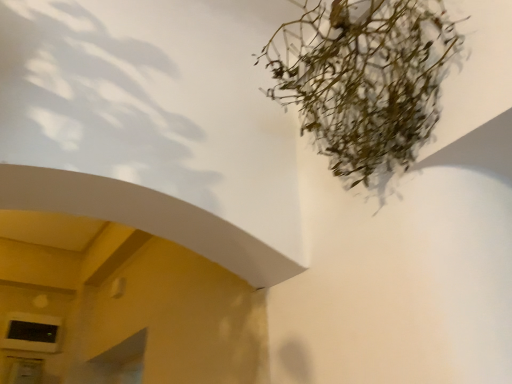
In order to click on matte black window at lower left in this screenshot , I will do click(x=32, y=332).

Measure the distance between matte black window at lower left and camera.

8.16 feet.

This screenshot has width=512, height=384. What do you see at coordinates (32, 332) in the screenshot?
I see `matte black window at lower left` at bounding box center [32, 332].

Locate an element on the screen. The width and height of the screenshot is (512, 384). green matte plant at upper right is located at coordinates (365, 80).

The width and height of the screenshot is (512, 384). What do you see at coordinates (365, 80) in the screenshot?
I see `green matte plant at upper right` at bounding box center [365, 80].

The height and width of the screenshot is (384, 512). Find the location of `matte black window at lower left`. matte black window at lower left is located at coordinates (32, 332).

Is matte black window at lower left to the right of green matte plant at upper right from the viewer's perspective?

No.

Who is more distant, matte black window at lower left or green matte plant at upper right?

matte black window at lower left is behind.

Considering the points (15, 339) and (340, 24), which point is behind, point (15, 339) or point (340, 24)?

The point (15, 339) is farther.

From the image's perspective, is matte black window at lower left located above or below green matte plant at upper right?

matte black window at lower left is situated lower than green matte plant at upper right in the image.

From a real-world perspective, is matte black window at lower left beneath green matte plant at upper right?

Yes, from a real-world perspective, matte black window at lower left is under green matte plant at upper right.

Considering the sizes of matte black window at lower left and green matte plant at upper right in the image, is matte black window at lower left wider or thinner than green matte plant at upper right?

In the image, matte black window at lower left appears to be more narrow than green matte plant at upper right.

Looking at this image, is matte black window at lower left shorter than green matte plant at upper right?

Indeed, matte black window at lower left has a lesser height compared to green matte plant at upper right.

Who is bigger, matte black window at lower left or green matte plant at upper right?

green matte plant at upper right is bigger.

Is matte black window at lower left inside or outside of green matte plant at upper right?

matte black window at lower left cannot be found inside green matte plant at upper right.

Is matte black window at lower left positioned far away from green matte plant at upper right?

Yes, matte black window at lower left and green matte plant at upper right are located far from each other.

Could you tell me if matte black window at lower left is facing green matte plant at upper right?

Yes, matte black window at lower left is turned towards green matte plant at upper right.

You are a GUI agent. You are given a task and a screenshot of the screen. Output one action in this format:
    pyautogui.click(x=<x>, y=<y>)
    Task: Click on the houseplant in front of the matte black window at lower left
    This screenshot has height=384, width=512.
    Given the screenshot: What is the action you would take?
    pyautogui.click(x=365, y=80)

Considering the positions of objects green matte plant at upper right and matte black window at lower left in the image provided, who is more to the left, green matte plant at upper right or matte black window at lower left?

From the viewer's perspective, matte black window at lower left appears more on the left side.

Is green matte plant at upper right positioned behind matte black window at lower left?

No, green matte plant at upper right is in front of matte black window at lower left.

Is point (352, 136) farther from camera compared to point (34, 320)?

No, it is in front of (34, 320).

From the image's perspective, is green matte plant at upper right above or below matte black window at lower left?

From the image's perspective, green matte plant at upper right appears above matte black window at lower left.

From a real-world perspective, which object rests below the other?

matte black window at lower left.

Is green matte plant at upper right wider or thinner than matte black window at lower left?

green matte plant at upper right is wider than matte black window at lower left.

From the picture: Which of these two, green matte plant at upper right or matte black window at lower left, stands taller?

green matte plant at upper right is taller.

Considering the sizes of objects green matte plant at upper right and matte black window at lower left in the image provided, who is bigger, green matte plant at upper right or matte black window at lower left?

green matte plant at upper right is bigger.

Is green matte plant at upper right inside the boundaries of matte black window at lower left, or outside?

green matte plant at upper right is not inside matte black window at lower left, it's outside.

Is green matte plant at upper right positioned far away from matte black window at lower left?

Yes.

Is green matte plant at upper right positioned with its back to matte black window at lower left?

No, green matte plant at upper right's orientation is not away from matte black window at lower left.

How different are the orientations of green matte plant at upper right and matte black window at lower left in degrees?

The angular difference between green matte plant at upper right and matte black window at lower left is 89.5 degrees.

How much distance is there between green matte plant at upper right and matte black window at lower left?

7.79 feet.

At what (x,y) coordinates should I click in order to perform the action: click on houseplant that is in front of the matte black window at lower left. Please return your answer as a coordinate pair (x, y). Looking at the image, I should click on (365, 80).

The height and width of the screenshot is (384, 512). In the image, there is a matte black window at lower left. What are the coordinates of `houseplant above it (from the image's perspective)` in the screenshot? It's located at (365, 80).

The width and height of the screenshot is (512, 384). Identify the location of window located below the green matte plant at upper right (from the image's perspective). (32, 332).